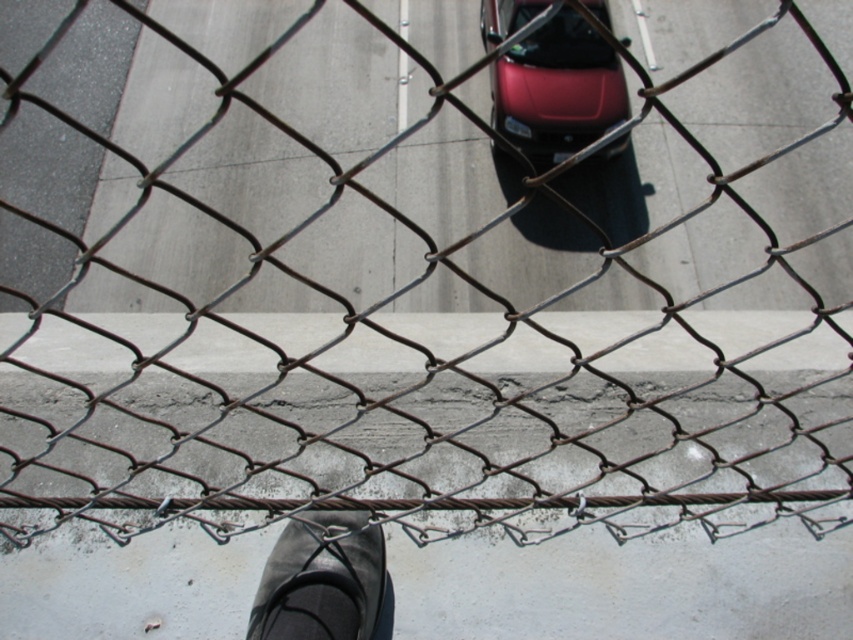
Question: Which point is closer to the camera?

Choices:
 (A) (299, 588)
 (B) (596, 125)

Answer: (A)

Question: Is glossy red car at center wider than black rubber shoe at lower center?

Choices:
 (A) yes
 (B) no

Answer: (A)

Question: Can you confirm if glossy red car at center is positioned to the left of black rubber shoe at lower center?

Choices:
 (A) no
 (B) yes

Answer: (A)

Question: Does glossy red car at center appear on the left side of black rubber shoe at lower center?

Choices:
 (A) yes
 (B) no

Answer: (B)